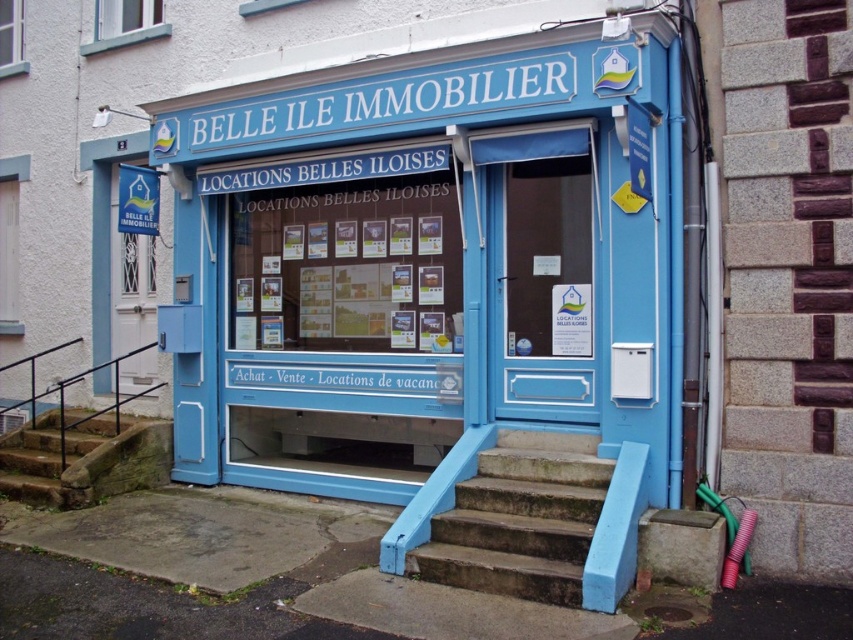
Question: Among these objects, which one is farthest from the camera?

Choices:
 (A) stone textured stairs at lower left
 (B) concrete stairs at center

Answer: (A)

Question: Can you confirm if brown wooden door at center is smaller than blue fabric banner at left?

Choices:
 (A) yes
 (B) no

Answer: (B)

Question: Which object is farther from the camera taking this photo?

Choices:
 (A) concrete stairs at center
 (B) white paper posters at center

Answer: (B)

Question: Is brown wooden door at center wider than stone textured stairs at lower left?

Choices:
 (A) yes
 (B) no

Answer: (B)

Question: Is blue painted wood storefront at center further to camera compared to blue fabric banner at left?

Choices:
 (A) no
 (B) yes

Answer: (A)

Question: Which of the following is the farthest from the observer?

Choices:
 (A) white paper posters at center
 (B) brown wooden door at center
 (C) blue fabric banner at left
 (D) blue painted wood storefront at center

Answer: (C)